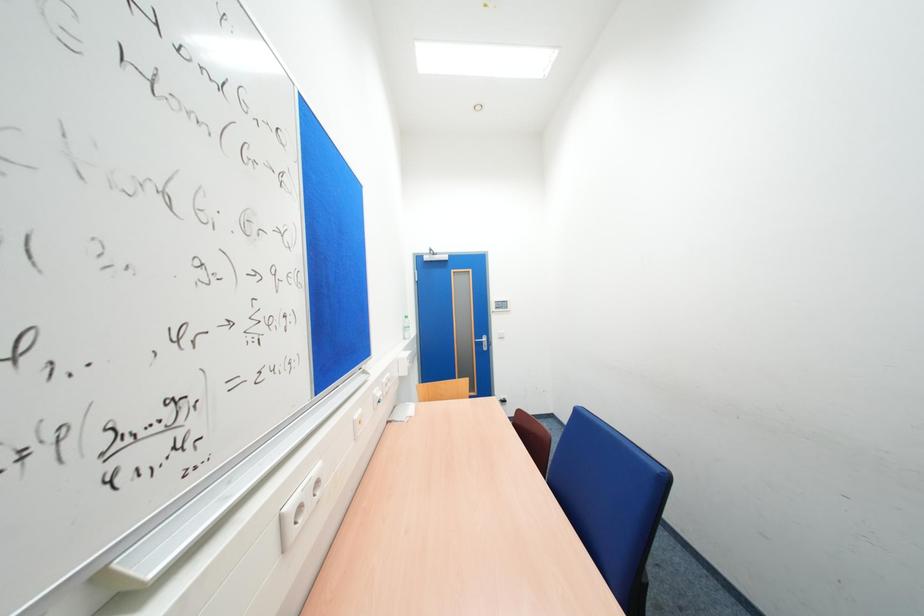
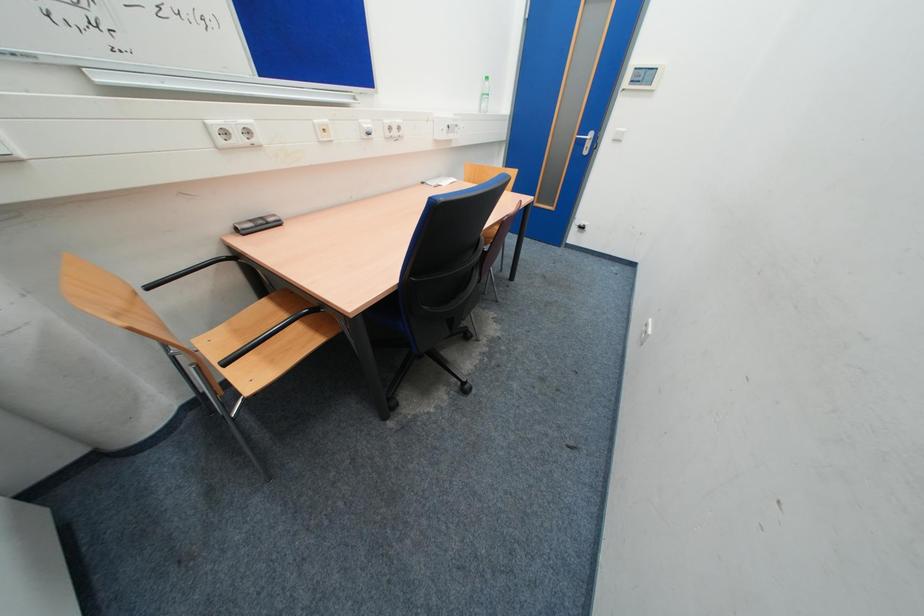
First-person continuous shooting, in which direction is the camera rotating?

The camera's rotation is toward left-down.